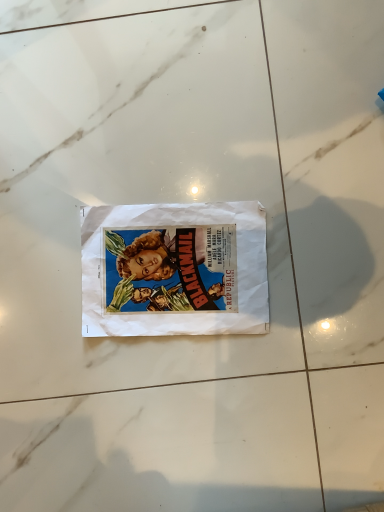
In order to click on empty space that is ontop of matte paper poster at center in this screenshot , I will do `click(168, 281)`.